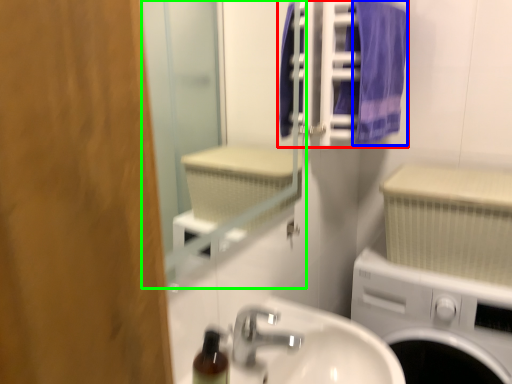
Question: Which object is the farthest from laundry (highlighted by a red box)? Choose among these: bath towel (highlighted by a blue box) or mirror (highlighted by a green box).

Choices:
 (A) bath towel
 (B) mirror

Answer: (B)